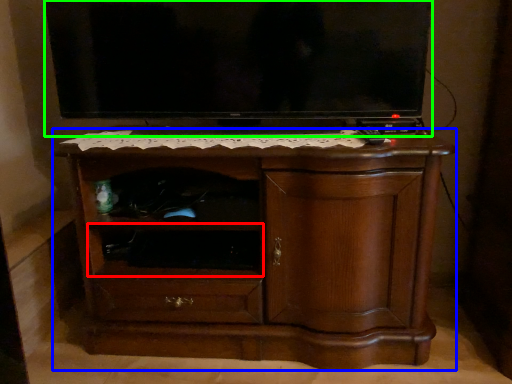
Question: Which object is the farthest from shelf (highlighted by a red box)? Choose among these: chest of drawers (highlighted by a blue box) or television (highlighted by a green box).

Choices:
 (A) chest of drawers
 (B) television

Answer: (B)